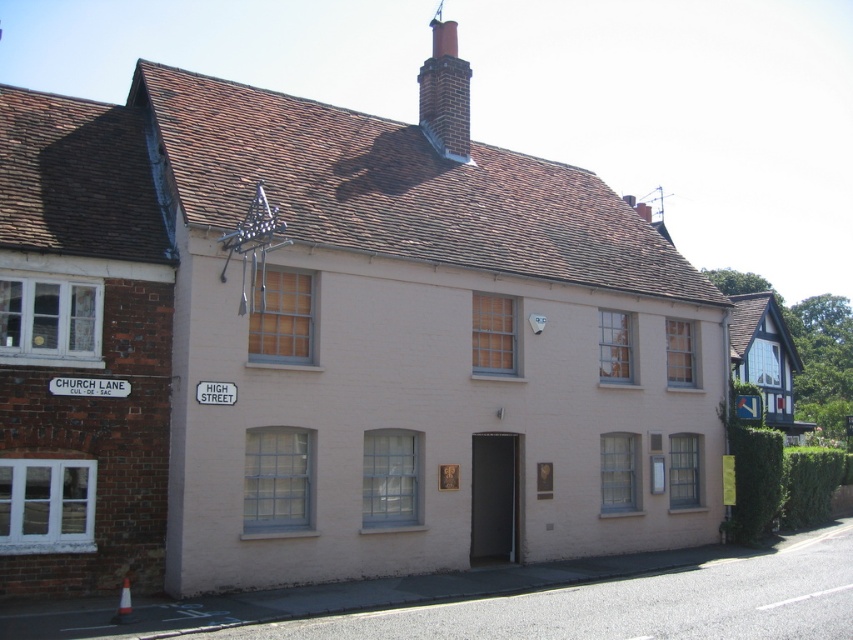
You are a drone operator trying to deliver a package to the roof of the two story building at the corner of Church Lane and High Street. The drone has a GPS coordinate system where the bottom left corner of the building is at point 0,0 and the top right corner is at point 1,1. The brick chimney at upper center is at point 0.147, 0.523. To avoid the chimney, where should you aim the drone to land on the roof?

The brick chimney at upper center is located at coordinate point (445, 93). To avoid it, aim the drone to land on the roof area that is not occupied by the chimney, such as coordinates outside the immediate vicinity of (445, 93).

You are a delivery person trying to determine the best route to the building. You notice the brick chimney at upper center and the white plastic street sign at upper left. Which of these two objects would be more likely to block your view of the building from a distance?

The brick chimney at upper center has a larger size compared to the white plastic street sign at upper left, so the brick chimney at upper center would more likely block your view of the building from a distance due to its larger size.